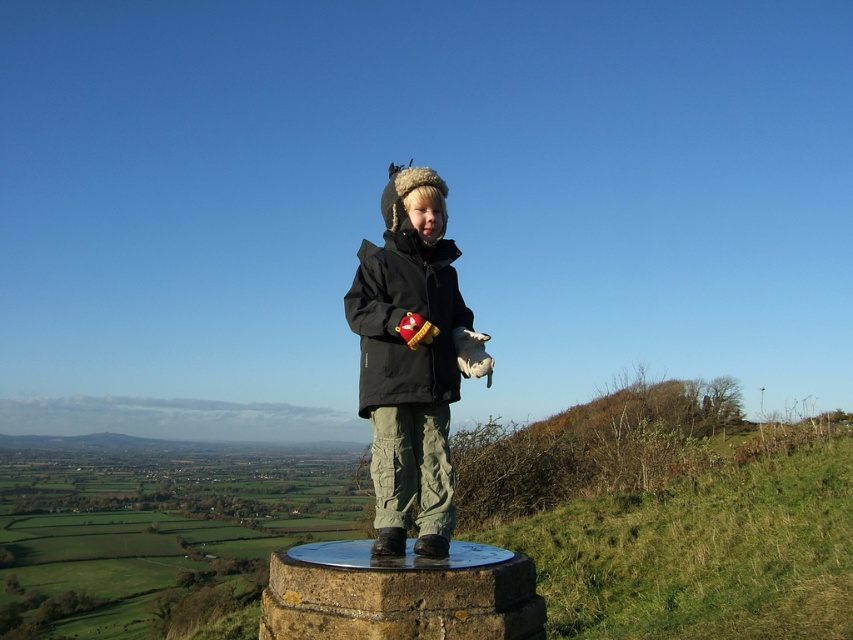
Between point (376, 609) and point (457, 369), which one is positioned in front?

Point (376, 609)

Identify the location of stone at center. The width and height of the screenshot is (853, 640). (399, 595).